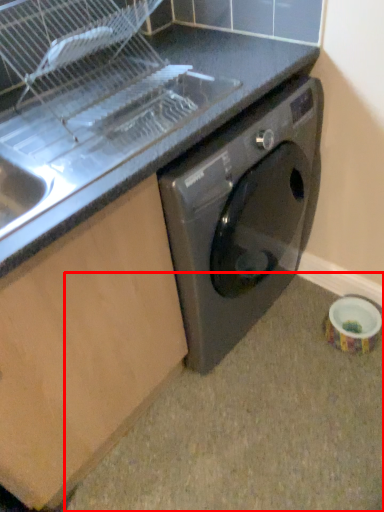
Question: Observing the image, what is the correct spatial positioning of granite (annotated by the red box) in reference to counter top?

Choices:
 (A) right
 (B) left

Answer: (A)